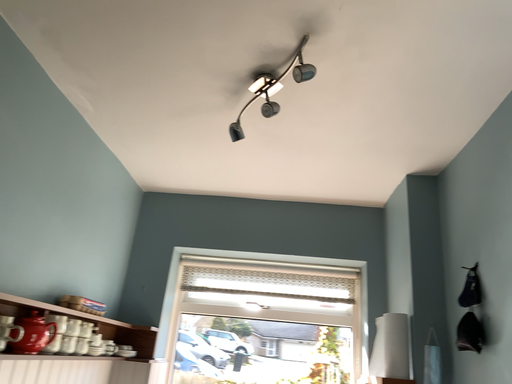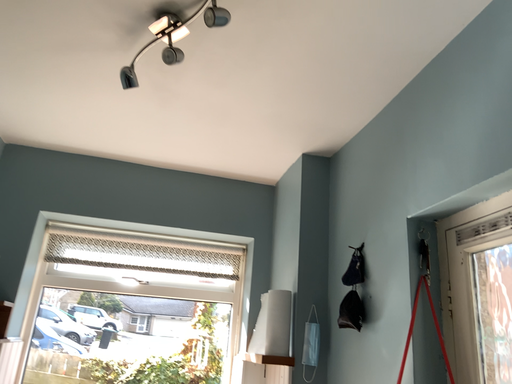
Question: Which way did the camera rotate in the video?

Choices:
 (A) rotated right
 (B) rotated left

Answer: (A)